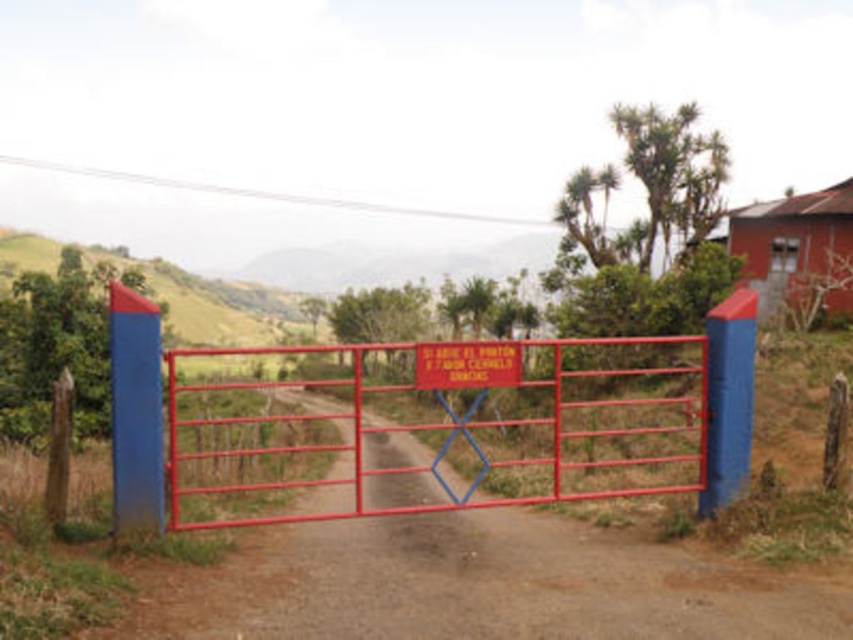
Which is more to the left, metal gate at center or red plastic sign at center?

metal gate at center

How much distance is there between metal gate at center and red plastic sign at center?

metal gate at center and red plastic sign at center are 68.57 feet apart.

You are a GUI agent. You are given a task and a screenshot of the screen. Output one action in this format:
    pyautogui.click(x=<x>, y=<y>)
    Task: Click on the metal gate at center
    The height and width of the screenshot is (640, 853).
    Given the screenshot: What is the action you would take?
    pyautogui.click(x=442, y=426)

How far apart are dirt track at center and red plastic sign at center?

17.50 feet

Is dirt track at center below red plastic sign at center?

Yes, dirt track at center is below red plastic sign at center.

Is point (305, 611) positioned before point (503, 381)?

Yes, point (305, 611) is in front of point (503, 381).

This screenshot has width=853, height=640. What are the coordinates of `dirt track at center` in the screenshot? It's located at (473, 586).

How far apart are dirt track at center and metal gate at center?

A distance of 7.35 meters exists between dirt track at center and metal gate at center.

From the picture: Is dirt track at center taller than metal gate at center?

Incorrect, dirt track at center's height is not larger of metal gate at center's.

Which is in front, point (438, 524) or point (198, 352)?

Point (198, 352) is more forward.

Find the location of a particular element. dirt track at center is located at coordinates (473, 586).